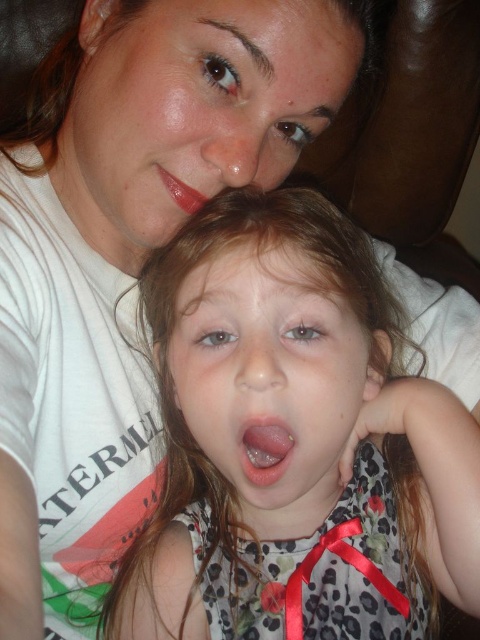
Question: Among these objects, which one is farthest from the camera?

Choices:
 (A) smooth skin face at center
 (B) pink glossy lips at center
 (C) floral-patterned dress at center

Answer: (B)

Question: Is smooth skin face at center wider than glossy matte lips at center?

Choices:
 (A) yes
 (B) no

Answer: (A)

Question: Can you confirm if matte white face at upper center is wider than smooth skin face at center?

Choices:
 (A) yes
 (B) no

Answer: (A)

Question: Among these points, which one is nearest to the camera?

Choices:
 (A) (276, 476)
 (B) (168, 179)

Answer: (A)

Question: Does smooth skin face at center come in front of glossy matte lips at center?

Choices:
 (A) yes
 (B) no

Answer: (A)

Question: Which object is farther from the camera taking this photo?

Choices:
 (A) matte white face at upper center
 (B) glossy matte lips at center
 (C) smooth skin face at center

Answer: (B)